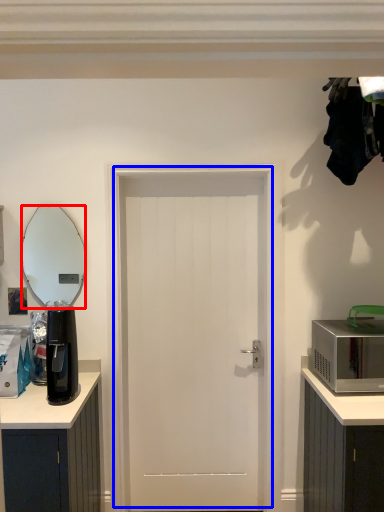
Question: Which object is closer to the camera taking this photo, mirror (highlighted by a red box) or door (highlighted by a blue box)?

Choices:
 (A) mirror
 (B) door

Answer: (B)